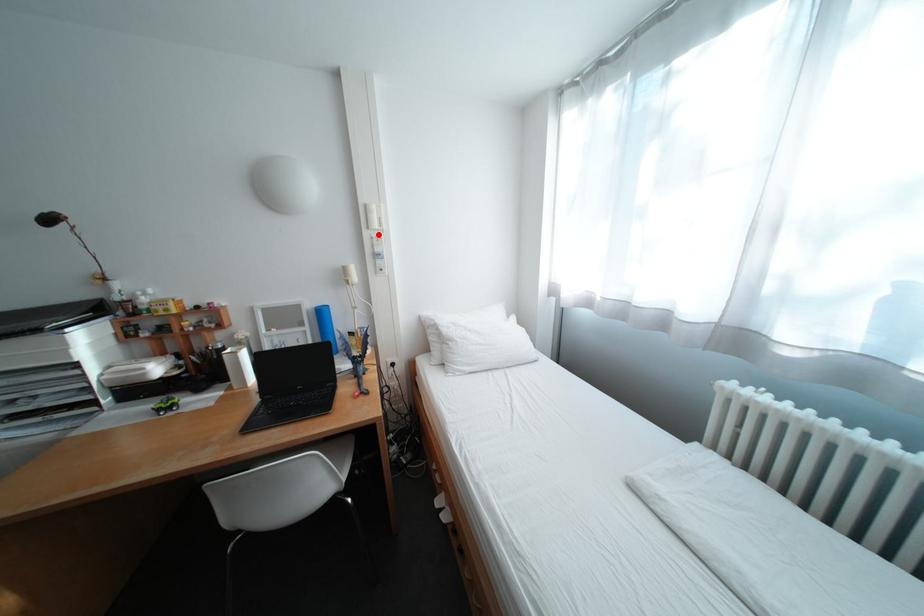
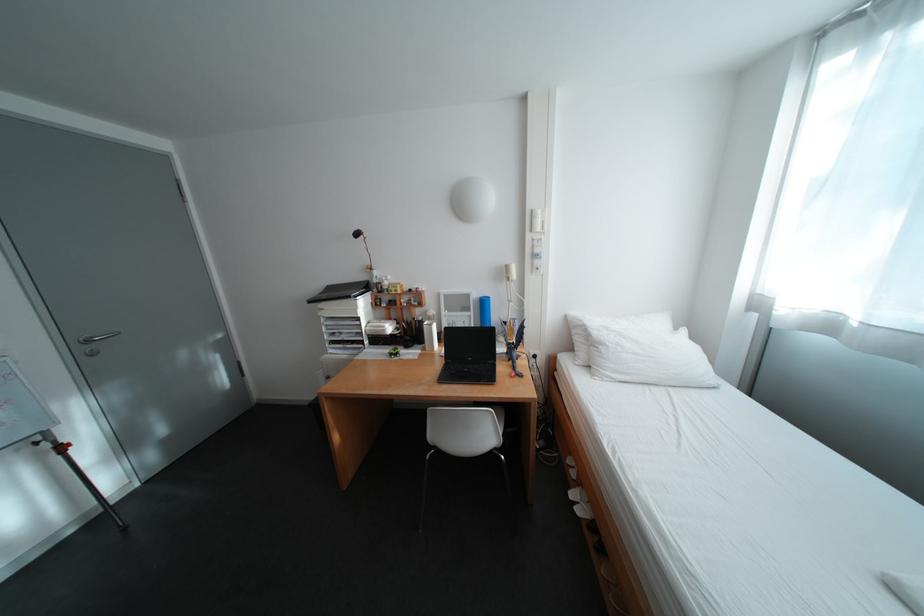
The point at the highlighted location is marked in the first image. Where is the corresponding point in the second image?

(541, 237)